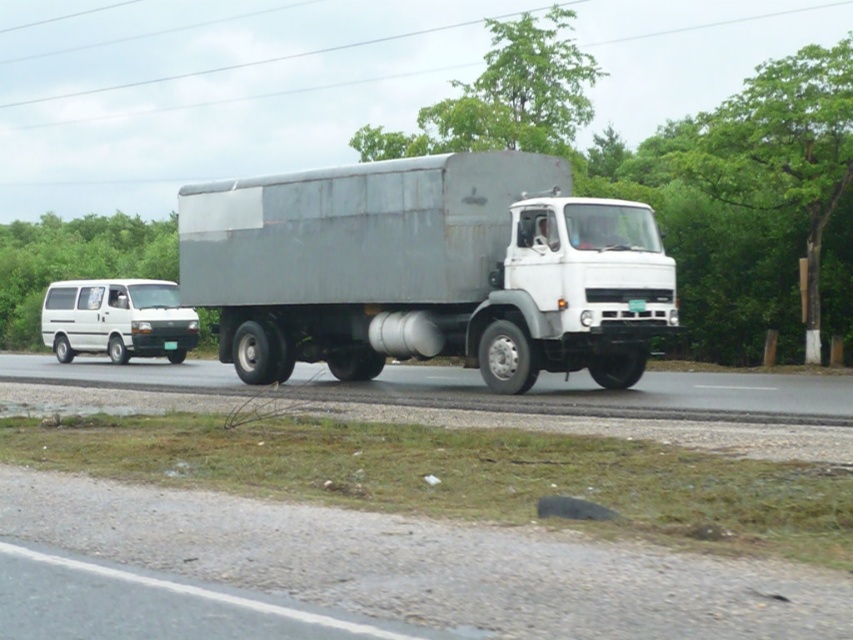
Can you confirm if gray matte trailer truck at center is shorter than white matte van at left?

In fact, gray matte trailer truck at center may be taller than white matte van at left.

Between gray matte trailer truck at center and white matte van at left, which one has more height?

gray matte trailer truck at center is taller.

Does point (543, 248) lie in front of point (123, 282)?

Yes, it is in front of point (123, 282).

This screenshot has height=640, width=853. Find the location of `gray matte trailer truck at center`. gray matte trailer truck at center is located at coordinates (427, 269).

Between gray matte trailer truck at center and smooth asphalt road at center, which one has less height?

smooth asphalt road at center

In the scene shown: Does gray matte trailer truck at center come behind smooth asphalt road at center?

Yes, it is behind smooth asphalt road at center.

Is point (621, 387) positioned behind point (370, 394)?

No, it is in front of (370, 394).

Where is `gray matte trailer truck at center`? The height and width of the screenshot is (640, 853). gray matte trailer truck at center is located at coordinates (427, 269).

Which of these two, smooth asphalt road at center or white matte van at left, stands taller?

Standing taller between the two is white matte van at left.

Is point (55, 380) less distant than point (115, 300)?

That is True.

Image resolution: width=853 pixels, height=640 pixels. In order to click on smooth asphalt road at center in this screenshot , I will do `click(485, 388)`.